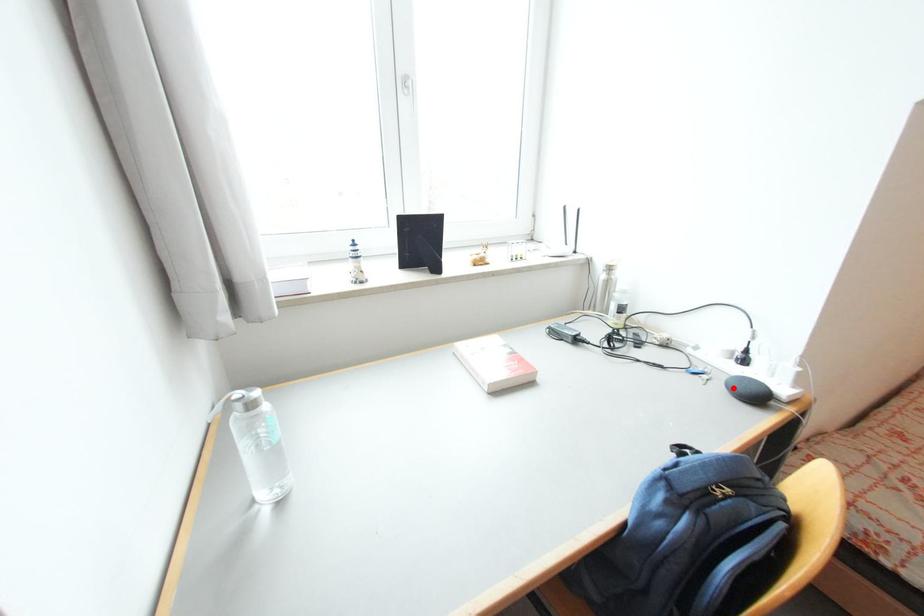
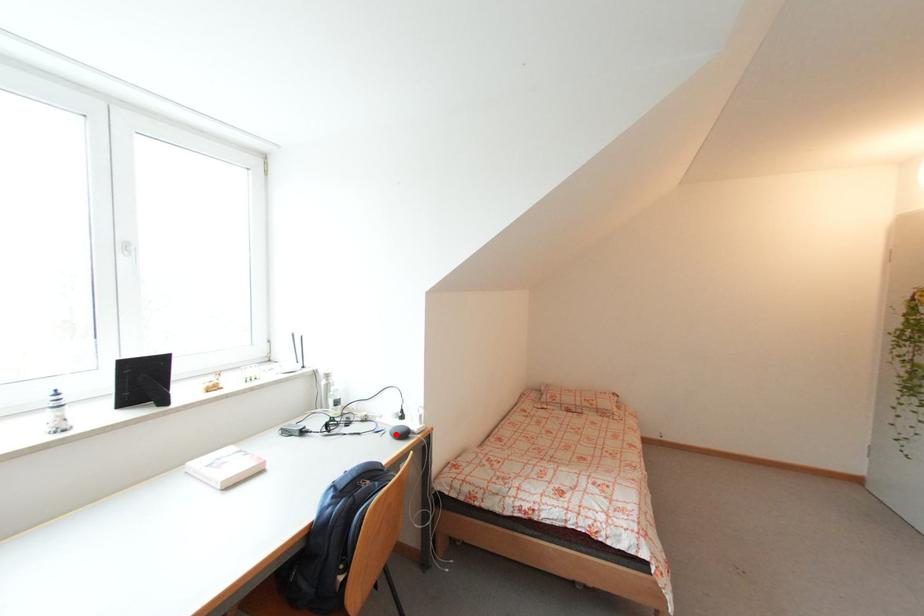
I am providing you with two images of the same scene from different viewpoints. A red point is marked on the first image and another point is marked on the second image. Do the highlighted points in image1 and image2 indicate the same real-world spot?

Yes